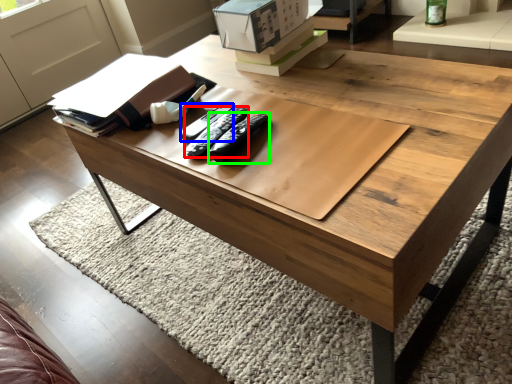
Question: Estimate the real-world distances between objects in this image. Which object is farther from remote (highlighted by a red box), remote (highlighted by a blue box) or remote (highlighted by a green box)?

Choices:
 (A) remote
 (B) remote

Answer: (B)